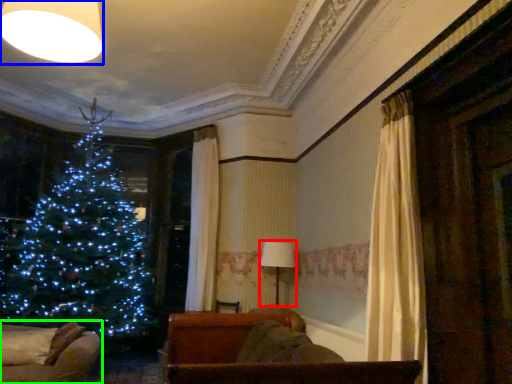
Question: Which object is the farthest from lamp (highlighted by a red box)? Choose among these: lighting (highlighted by a blue box) or furniture (highlighted by a green box).

Choices:
 (A) lighting
 (B) furniture

Answer: (A)